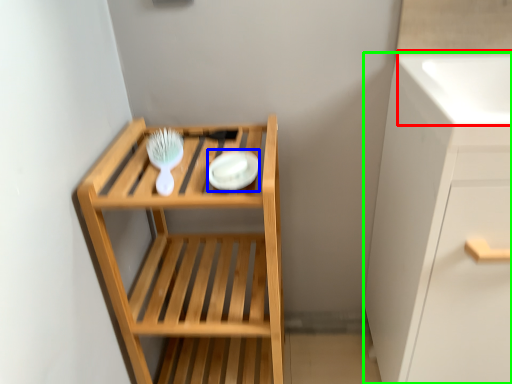
Question: Which object is positioned farthest from sink (highlighted by a red box)? Select from platter (highlighted by a blue box) and cabinetry (highlighted by a green box).

Choices:
 (A) platter
 (B) cabinetry

Answer: (A)